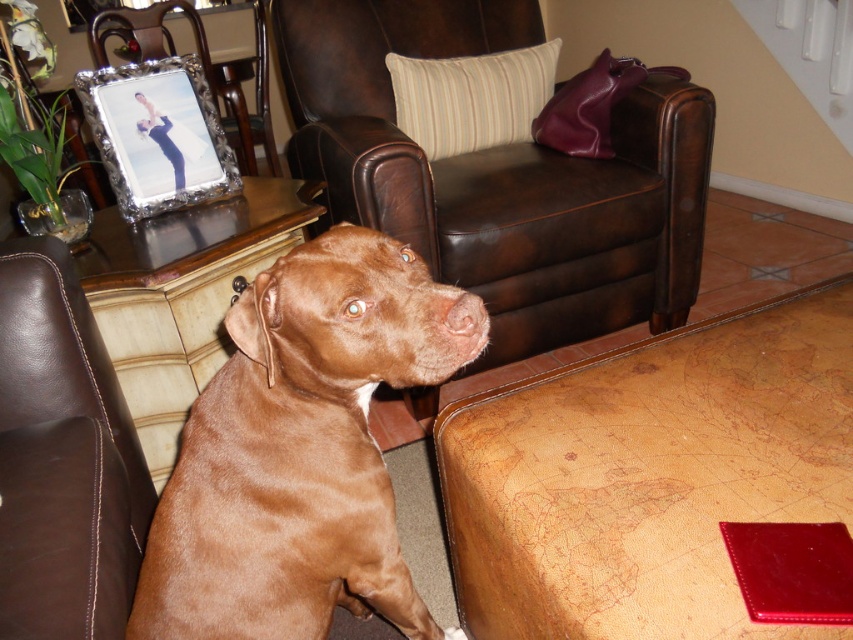
In the scene shown: You are standing in the room and want to place a new decorative item on the couch. The couch has a red rectangular object on its right side. Where should you place the new item so it doesn not interfere with the brown smooth dog at center?

Since the brown smooth dog at center is positioned at point (300,451), you should place the new decorative item away from that area to avoid interference.

You are a person who is 1.7 meters tall and standing in front of the brown leather armchair at center. Can you sit down on it without bending over?

The brown leather armchair at center is 1.62 meters away from the viewer, so yes, you can sit down on it without bending over since the distance is sufficient for a person of your height.

You are a delivery person trying to place a small package on the brown leather couch at lower left. The brown smooth dog at center is in the way. Can you move the dog to the side to make space?

The brown smooth dog at center is below the brown leather couch at lower left, so it cannot be moved to the side as it is already positioned under the couch.